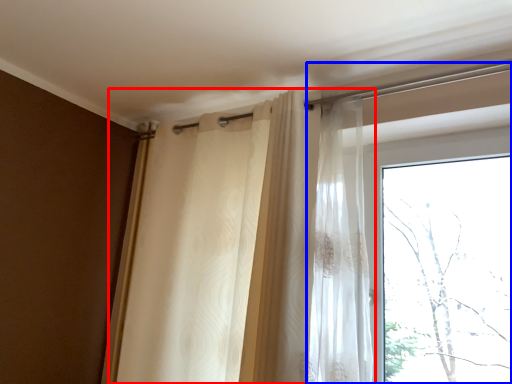
Question: Which of the following is the farthest to the observer, curtain (highlighted by a red box) or window (highlighted by a blue box)?

Choices:
 (A) curtain
 (B) window

Answer: (B)